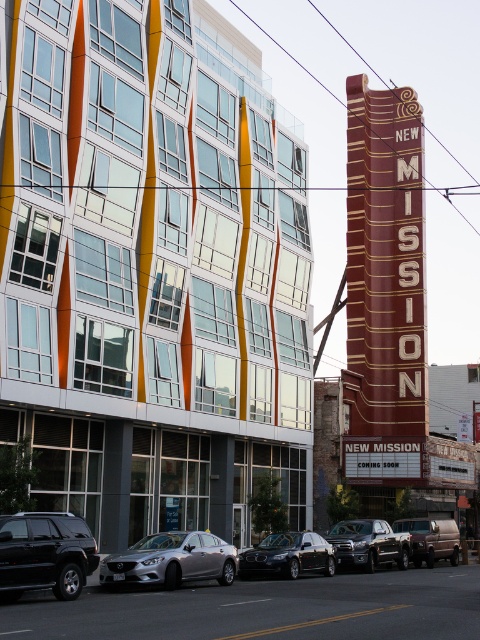
Which is below, glassy reflective building at center or metallic silver van at center?

metallic silver van at center is below.

Between point (117, 388) and point (454, 560), which one is positioned behind?

Point (454, 560)

This screenshot has width=480, height=640. I want to click on glassy reflective building at center, so click(152, 268).

Who is taller, brown/marble-like sign at upper center or silver metallic sedan at center?

Standing taller between the two is brown/marble-like sign at upper center.

Is point (400, 304) positioned in front of point (108, 561)?

No.

Identify the location of brown/marble-like sign at upper center. This screenshot has height=640, width=480. (384, 288).

Measure the distance between shiny black sedan at center and metallic silver van at center.

A distance of 35.38 feet exists between shiny black sedan at center and metallic silver van at center.

Consider the image. Which is above, shiny black sedan at center or metallic silver van at center?

shiny black sedan at center is above.

Where is `shiny black sedan at center`? This screenshot has height=640, width=480. shiny black sedan at center is located at coordinates (288, 556).

Where is `shiny black sedan at center`? The image size is (480, 640). shiny black sedan at center is located at coordinates (288, 556).